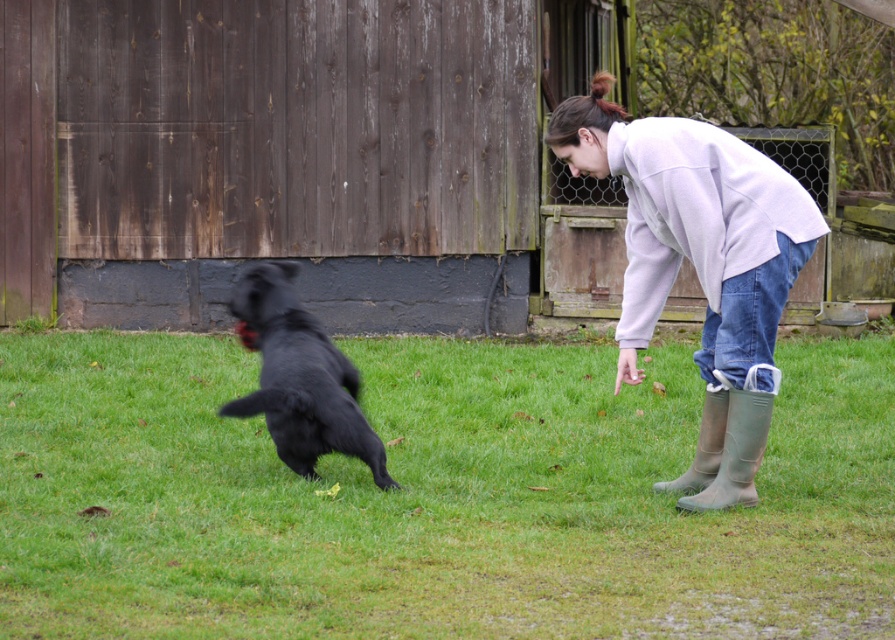
Looking at this image, you are standing at the point marked as point [697,477] in the image. You want to walk straight towards the shed in the background. How far will you have to walk to reach the shed?

The distance between point [697,477] and the viewer is 27.60 feet. Since the shed is in the background, you would need to walk 27.60 feet to reach it.